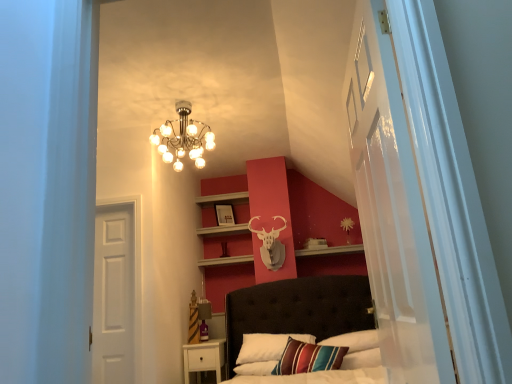
Question: Are metallic chandelier at upper center and transparent glass door at right far apart?

Choices:
 (A) no
 (B) yes

Answer: (B)

Question: Considering the relative sizes of metallic chandelier at upper center and transparent glass door at right in the image provided, is metallic chandelier at upper center thinner than transparent glass door at right?

Choices:
 (A) yes
 (B) no

Answer: (B)

Question: Does metallic chandelier at upper center have a greater height compared to transparent glass door at right?

Choices:
 (A) yes
 (B) no

Answer: (B)

Question: Is metallic chandelier at upper center facing towards transparent glass door at right?

Choices:
 (A) yes
 (B) no

Answer: (B)

Question: Can you confirm if metallic chandelier at upper center is shorter than transparent glass door at right?

Choices:
 (A) yes
 (B) no

Answer: (A)

Question: Could transparent glass door at right be considered to be inside metallic chandelier at upper center?

Choices:
 (A) no
 (B) yes

Answer: (A)

Question: Does transparent glass door at right have a greater height compared to metallic chandelier at upper center?

Choices:
 (A) no
 (B) yes

Answer: (B)

Question: From the image's perspective, is transparent glass door at right located beneath metallic chandelier at upper center?

Choices:
 (A) yes
 (B) no

Answer: (A)

Question: From the image's perspective, is transparent glass door at right located above metallic chandelier at upper center?

Choices:
 (A) yes
 (B) no

Answer: (B)

Question: Is metallic chandelier at upper center at the back of transparent glass door at right?

Choices:
 (A) no
 (B) yes

Answer: (A)

Question: From a real-world perspective, is transparent glass door at right over metallic chandelier at upper center?

Choices:
 (A) yes
 (B) no

Answer: (B)

Question: Considering the relative positions of transparent glass door at right and metallic chandelier at upper center in the image provided, is transparent glass door at right in front of metallic chandelier at upper center?

Choices:
 (A) no
 (B) yes

Answer: (B)

Question: Does metallic chandelier at upper center have a lesser width compared to matte wooden picture frame at upper center?

Choices:
 (A) no
 (B) yes

Answer: (A)